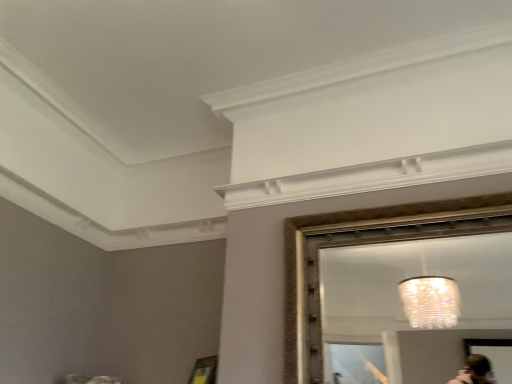
I want to click on gold textured mirror at upper center, so click(398, 292).

What do you see at coordinates (398, 292) in the screenshot? I see `gold textured mirror at upper center` at bounding box center [398, 292].

At what (x,y) coordinates should I click in order to perform the action: click on gold textured mirror at upper center. Please return your answer as a coordinate pair (x, y). Image resolution: width=512 pixels, height=384 pixels. Looking at the image, I should click on (398, 292).